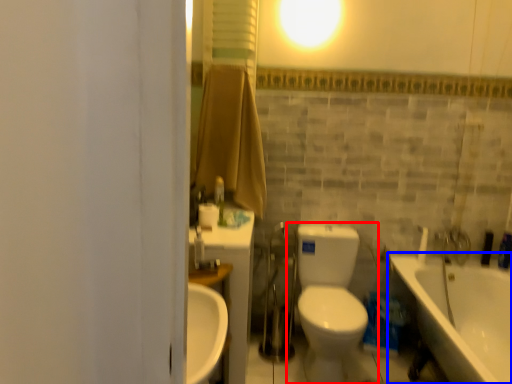
Question: Among these objects, which one is nearest to the camera, toilet (highlighted by a red box) or bathtub (highlighted by a blue box)?

Choices:
 (A) toilet
 (B) bathtub

Answer: (B)